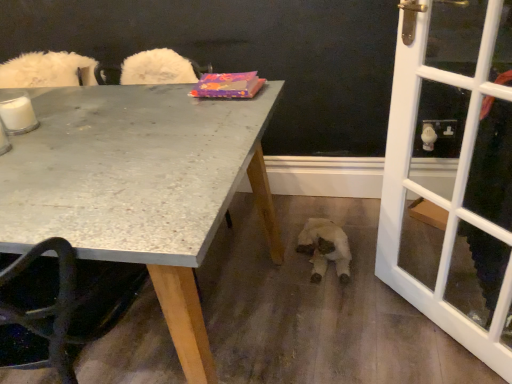
I want to click on vacant area that lies in front of white plush toy at lower center, so click(x=335, y=299).